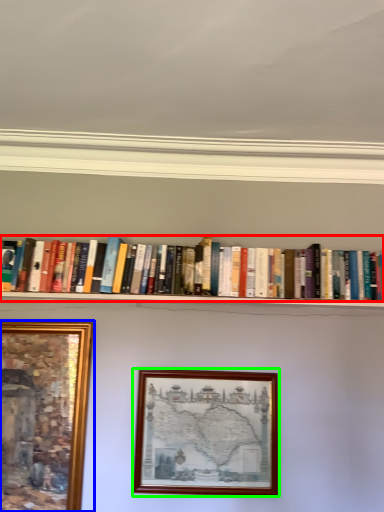
Question: Which is farther away from book (highlighted by a red box)? picture frame (highlighted by a blue box) or picture frame (highlighted by a green box)?

Choices:
 (A) picture frame
 (B) picture frame

Answer: (A)